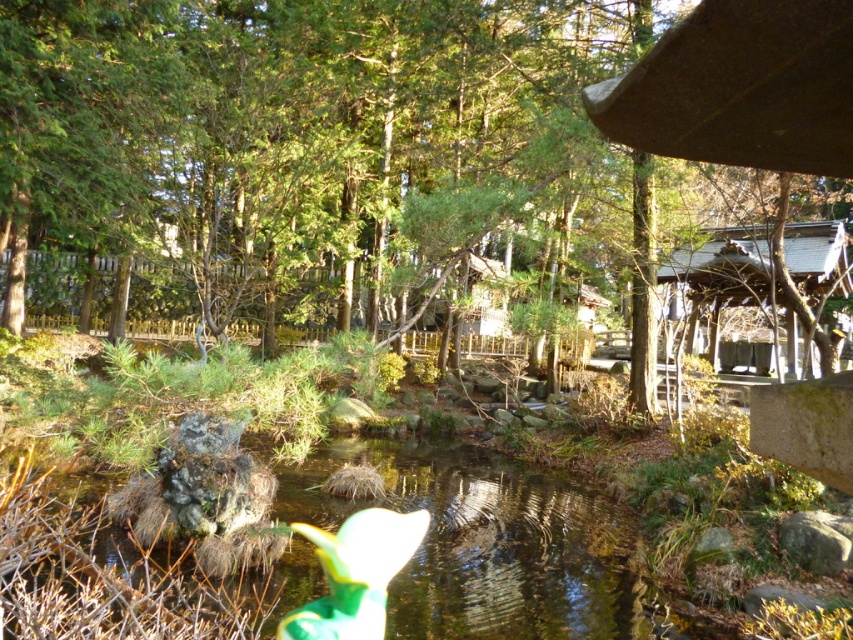
You are standing in the garden and want to take a photo of the green leafy tree at center and the clear water at center. Which object will appear larger in the photo?

The green leafy tree at center will appear larger in the photo because it is closer to the viewer than the clear water at center.

You are planning to place a new bench in the scene. The bench is 1.2 meters wide. You want to place it next to the wooden cabin at right and the green fabric toy at lower center. Which object should you place it next to if the bench needs to fit without overlapping either object?

The wooden cabin at right has a lesser width compared to green fabric toy at lower center. Therefore, placing the bench next to the wooden cabin at right would be more feasible since it has less width, allowing the bench to fit without overlapping.